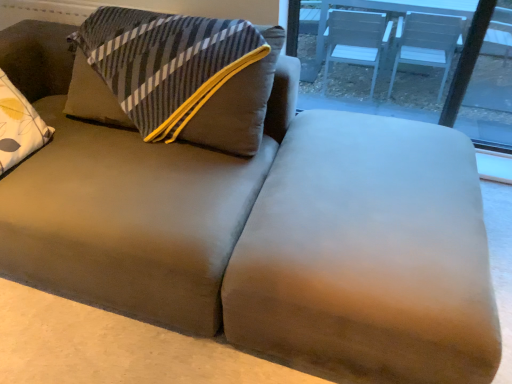
The height and width of the screenshot is (384, 512). Describe the element at coordinates (414, 68) in the screenshot. I see `transparent glass table at upper right` at that location.

Where is `transparent glass table at upper right`? transparent glass table at upper right is located at coordinates (414, 68).

Locate an element on the screen. Image resolution: width=512 pixels, height=384 pixels. suede-like brown ottoman at center is located at coordinates (368, 254).

This screenshot has width=512, height=384. Describe the element at coordinates (368, 254) in the screenshot. I see `suede-like brown ottoman at center` at that location.

Image resolution: width=512 pixels, height=384 pixels. What are the coordinates of `transparent glass table at upper right` in the screenshot? It's located at (414, 68).

Considering the relative positions of suede-like brown ottoman at center and transparent glass table at upper right in the image provided, is suede-like brown ottoman at center to the right of transparent glass table at upper right from the viewer's perspective?

In fact, suede-like brown ottoman at center is to the left of transparent glass table at upper right.

Which object is closer to the camera, suede-like brown ottoman at center or transparent glass table at upper right?

suede-like brown ottoman at center is in front.

Which is nearer, (x=416, y=195) or (x=396, y=48)?

The point (x=416, y=195) is more forward.

From the image's perspective, which one is positioned lower, suede-like brown ottoman at center or transparent glass table at upper right?

From the image's view, suede-like brown ottoman at center is below.

From a real-world perspective, between suede-like brown ottoman at center and transparent glass table at upper right, who is vertically lower?

From a 3D spatial view, suede-like brown ottoman at center is below.

Considering the relative sizes of suede-like brown ottoman at center and transparent glass table at upper right in the image provided, is suede-like brown ottoman at center thinner than transparent glass table at upper right?

In fact, suede-like brown ottoman at center might be wider than transparent glass table at upper right.

Is suede-like brown ottoman at center taller or shorter than transparent glass table at upper right?

Clearly, suede-like brown ottoman at center is shorter compared to transparent glass table at upper right.

Is suede-like brown ottoman at center smaller than transparent glass table at upper right?

Actually, suede-like brown ottoman at center might be larger than transparent glass table at upper right.

Is suede-like brown ottoman at center completely or partially outside of transparent glass table at upper right?

Yes, suede-like brown ottoman at center is not within transparent glass table at upper right.

Is suede-like brown ottoman at center next to transparent glass table at upper right?

suede-like brown ottoman at center and transparent glass table at upper right are clearly separated.

Is suede-like brown ottoman at center aimed at transparent glass table at upper right?

No, suede-like brown ottoman at center is not facing towards transparent glass table at upper right.

How many degrees apart are the facing directions of suede-like brown ottoman at center and transparent glass table at upper right?

The facing directions of suede-like brown ottoman at center and transparent glass table at upper right are 1.36 degrees apart.

How far apart are suede-like brown ottoman at center and transparent glass table at upper right?

suede-like brown ottoman at center is 3.73 feet away from transparent glass table at upper right.

This screenshot has height=384, width=512. I want to click on flat lying in front of the transparent glass table at upper right, so click(368, 254).

In the image, is transparent glass table at upper right on the left side or the right side of suede-like brown ottoman at center?

Clearly, transparent glass table at upper right is on the right of suede-like brown ottoman at center in the image.

Which object is further away from the camera taking this photo, transparent glass table at upper right or suede-like brown ottoman at center?

Positioned behind is transparent glass table at upper right.

Which point is more forward, [447,60] or [437,281]?

Point [437,281]

Consider the image. From the image's perspective, is transparent glass table at upper right positioned above or below suede-like brown ottoman at center?

Based on their image positions, transparent glass table at upper right is located above suede-like brown ottoman at center.

From a real-world perspective, is transparent glass table at upper right physically located above or below suede-like brown ottoman at center?

Clearly, from a real-world perspective, transparent glass table at upper right is above suede-like brown ottoman at center.

Between transparent glass table at upper right and suede-like brown ottoman at center, which one has larger width?

Wider between the two is suede-like brown ottoman at center.

Between transparent glass table at upper right and suede-like brown ottoman at center, which one has more height?

Standing taller between the two is transparent glass table at upper right.

Who is bigger, transparent glass table at upper right or suede-like brown ottoman at center?

With larger size is suede-like brown ottoman at center.

In the scene shown: Is transparent glass table at upper right outside of suede-like brown ottoman at center?

Yes, transparent glass table at upper right is located beyond the bounds of suede-like brown ottoman at center.

Is transparent glass table at upper right next to suede-like brown ottoman at center and touching it?

No, transparent glass table at upper right is not with suede-like brown ottoman at center.

Is transparent glass table at upper right turned away from suede-like brown ottoman at center?

No, transparent glass table at upper right's orientation is not away from suede-like brown ottoman at center.

How many degrees apart are the facing directions of transparent glass table at upper right and suede-like brown ottoman at center?

The facing directions of transparent glass table at upper right and suede-like brown ottoman at center are 1.36 degrees apart.

Identify the location of flat located below the transparent glass table at upper right (from the image's perspective). The image size is (512, 384). (368, 254).

At what (x,y) coordinates should I click in order to perform the action: click on window behind the suede-like brown ottoman at center. Please return your answer as a coordinate pair (x, y). This screenshot has width=512, height=384. Looking at the image, I should click on click(414, 68).

You are a GUI agent. You are given a task and a screenshot of the screen. Output one action in this format:
    pyautogui.click(x=<x>, y=<y>)
    Task: Click on the window lying above the suede-like brown ottoman at center (from the image's perspective)
    This screenshot has width=512, height=384.
    Given the screenshot: What is the action you would take?
    pyautogui.click(x=414, y=68)